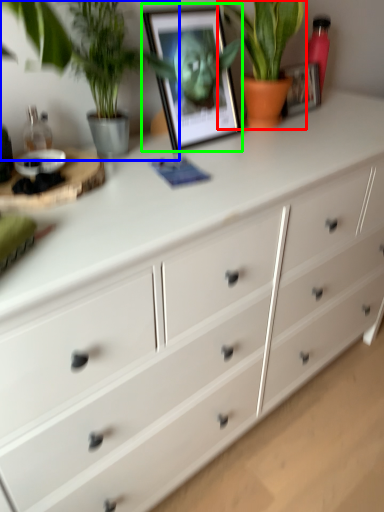
Question: Which object is the closest to the houseplant (highlighted by a red box)? Choose among these: houseplant (highlighted by a blue box) or picture frame (highlighted by a green box).

Choices:
 (A) houseplant
 (B) picture frame

Answer: (B)